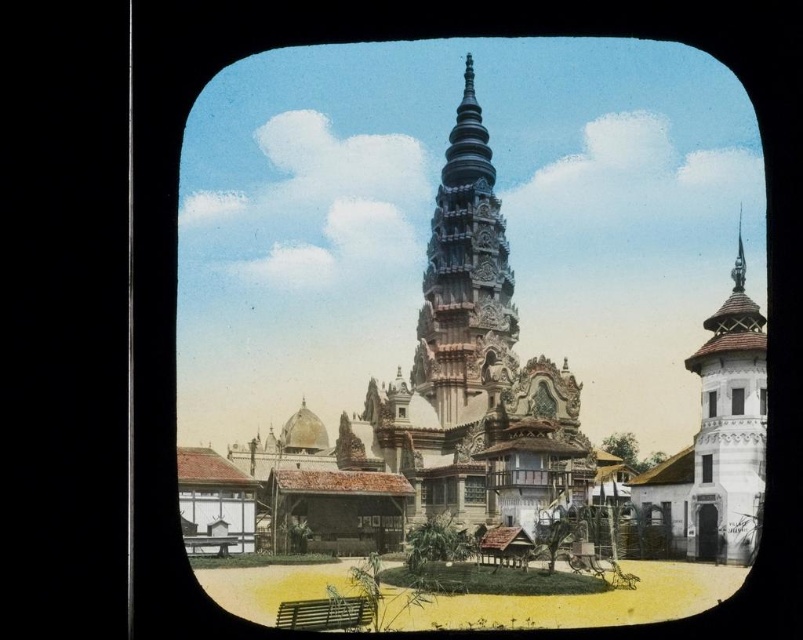
Is point (732, 317) farther from viewer compared to point (703, 483)?

That is True.

Which is behind, point (749, 529) or point (710, 465)?

Point (710, 465)

What do you see at coordinates (728, 428) in the screenshot? This screenshot has height=640, width=803. I see `white textured tower at right` at bounding box center [728, 428].

This screenshot has width=803, height=640. Identify the location of white textured tower at right. (728, 428).

Is white textured tower at right smaller than black glass window at upper right?

Incorrect, white textured tower at right is not smaller in size than black glass window at upper right.

Is white textured tower at right taller than black glass window at upper right?

Yes, white textured tower at right is taller than black glass window at upper right.

Who is more forward, (x=744, y=260) or (x=740, y=397)?

Point (x=740, y=397) is in front.

Find the location of `white textured tower at right`. white textured tower at right is located at coordinates click(x=728, y=428).

Does shiny silver spire at upper right come in front of transparent glass window at center?

Yes, shiny silver spire at upper right is closer to the viewer.

Does shiny silver spire at upper right have a smaller size compared to transparent glass window at center?

Actually, shiny silver spire at upper right might be larger than transparent glass window at center.

The image size is (803, 640). I want to click on shiny silver spire at upper right, so click(738, 259).

I want to click on shiny silver spire at upper right, so click(738, 259).